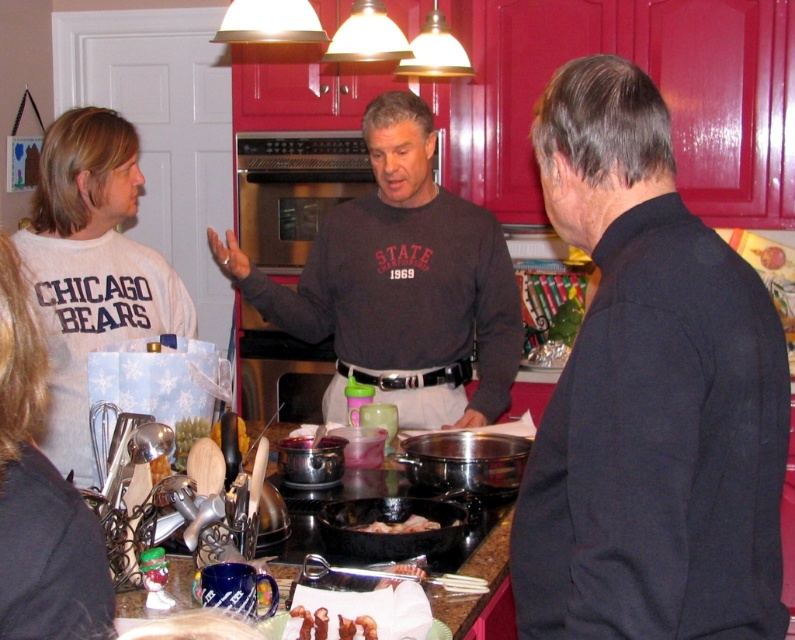
You are standing in the kitchen and want to hand a recipe card to both the person wearing the black matte jacket at right and the person in the dark gray sweatshirt at center. Which person should you approach first to ensure you can reach them without moving around any obstacles?

You should approach the black matte jacket at right first because it is closer to you than the dark gray sweatshirt at center, so you can reach them without needing to move around obstacles.